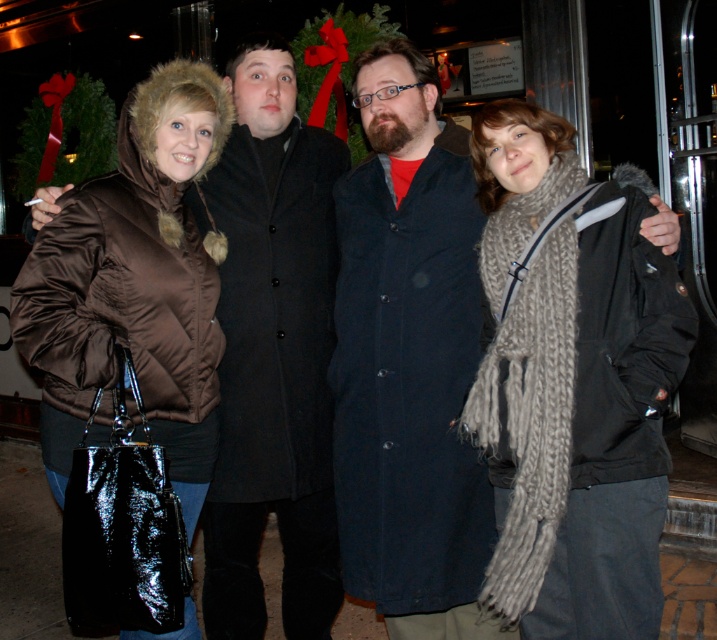
Based on the photo, can you confirm if knitted gray scarf at center is positioned to the left of brown shiny coat at left?

Incorrect, knitted gray scarf at center is not on the left side of brown shiny coat at left.

Does knitted gray scarf at center have a greater height compared to brown shiny coat at left?

Yes, knitted gray scarf at center is taller than brown shiny coat at left.

Does point (531, 269) come behind point (189, 422)?

No.

Image resolution: width=717 pixels, height=640 pixels. I want to click on knitted gray scarf at center, so click(571, 381).

This screenshot has width=717, height=640. What are the coordinates of `dark blue wool coat at center` in the screenshot? It's located at pyautogui.click(x=409, y=358).

In order to click on dark blue wool coat at center in this screenshot , I will do `click(409, 358)`.

Where is `dark blue wool coat at center`? Image resolution: width=717 pixels, height=640 pixels. dark blue wool coat at center is located at coordinates (409, 358).

Is knitted gray scarf at center wider than dark blue wool coat at center?

No, knitted gray scarf at center is not wider than dark blue wool coat at center.

Is point (559, 596) farther from camera compared to point (356, 266)?

No.

Locate an element on the screen. The image size is (717, 640). knitted gray scarf at center is located at coordinates 571,381.